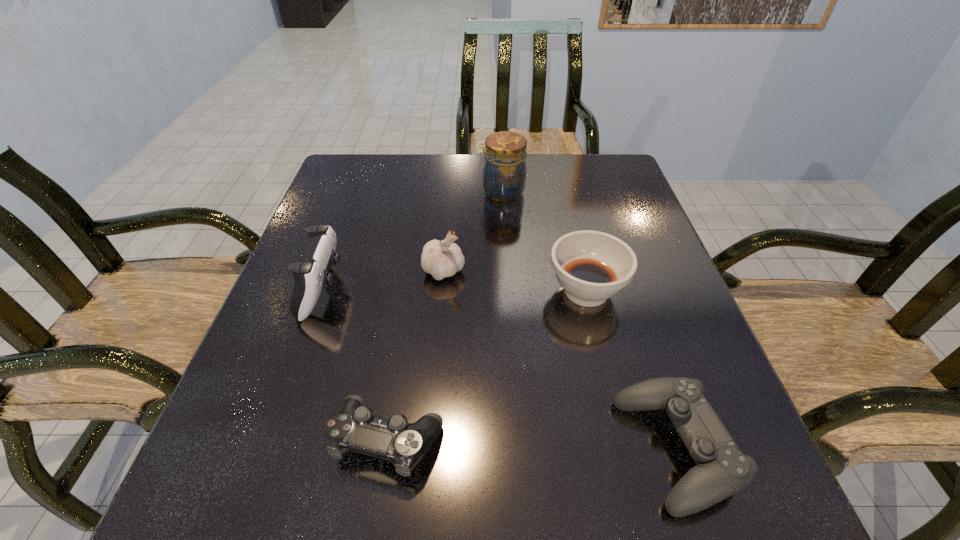
Locate an element on the screen. The height and width of the screenshot is (540, 960). free space located 0.100m on the lid of the fourth object from left to right is located at coordinates (442, 192).

The width and height of the screenshot is (960, 540). Identify the location of free space located on the front-facing side of the leftmost control. pyautogui.click(x=456, y=289).

I want to click on vacant space situated on the left of the garlic, so click(314, 272).

I want to click on vacant space situated 0.100m on the left of the fourth tallest object, so click(x=499, y=291).

Find the location of a particular element. blank area located 0.250m on the right of the second control from left to right is located at coordinates (602, 439).

Identify the location of vacant region located 0.100m on the left of the rightmost control. (557, 450).

Locate an element on the screen. object situated at the far edge is located at coordinates (504, 174).

What are the coordinates of `object that is at the left edge` in the screenshot? It's located at (310, 275).

At what (x,y) coordinates should I click in order to perform the action: click on soup bowl present at the right edge. Please return your answer as a coordinate pair (x, y). Image resolution: width=960 pixels, height=540 pixels. Looking at the image, I should click on [x=592, y=266].

Identify the location of control that is at the right edge. (722, 470).